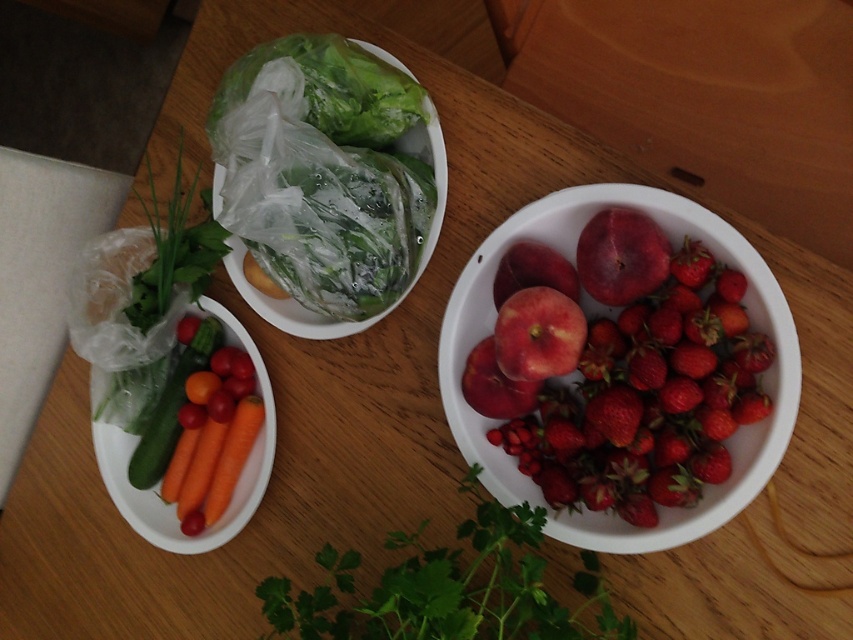
Question: Does green matte celery at lower left have a lesser width compared to glossy red apple at center?

Choices:
 (A) yes
 (B) no

Answer: (B)

Question: Which of the following is the farthest from the observer?

Choices:
 (A) green matte celery at lower left
 (B) green leafy parsley at lower center
 (C) glossy red apple at center
 (D) orange smooth carrot at lower left

Answer: (A)

Question: Does white glossy bowl at right have a lesser width compared to red matte apple at center-right?

Choices:
 (A) yes
 (B) no

Answer: (B)

Question: Is smooth plastic carrots at left above glossy red apple at upper right?

Choices:
 (A) yes
 (B) no

Answer: (B)

Question: Which of the following is the farthest from the observer?

Choices:
 (A) (440, 204)
 (B) (593, 292)

Answer: (A)

Question: Estimate the real-world distances between objects in this image. Which object is closer to the red matte apple at center-right?

Choices:
 (A) smooth plastic carrots at left
 (B) green matte celery at lower left

Answer: (A)